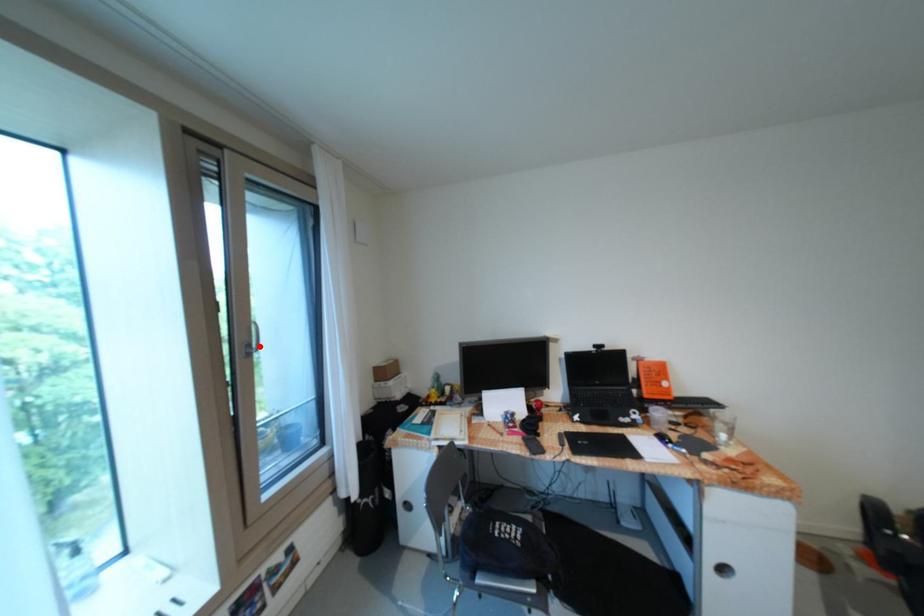
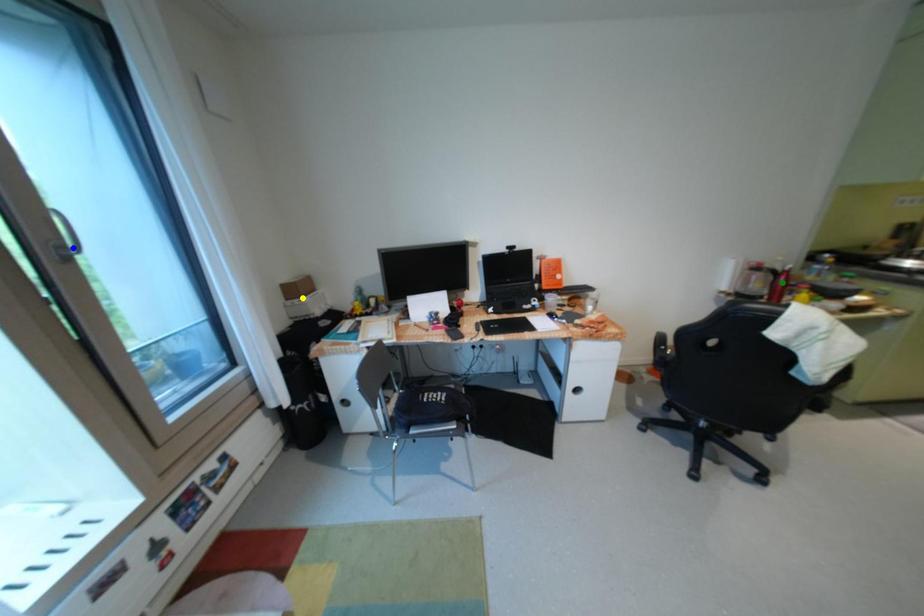
Question: I am providing you with two images of the same scene from different viewpoints. A red point is marked on the first image. You are given multiple points on the second image. Which spot in image 2 lines up with the point in image 1?

Choices:
 (A) yellow point
 (B) blue point
 (C) green point

Answer: (B)